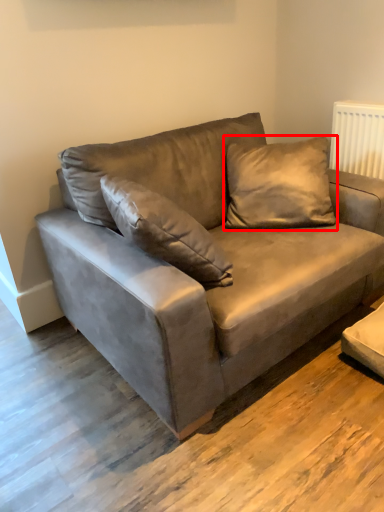
Question: Where is pillow (annotated by the red box) located in relation to studio couch in the image?

Choices:
 (A) right
 (B) left

Answer: (A)